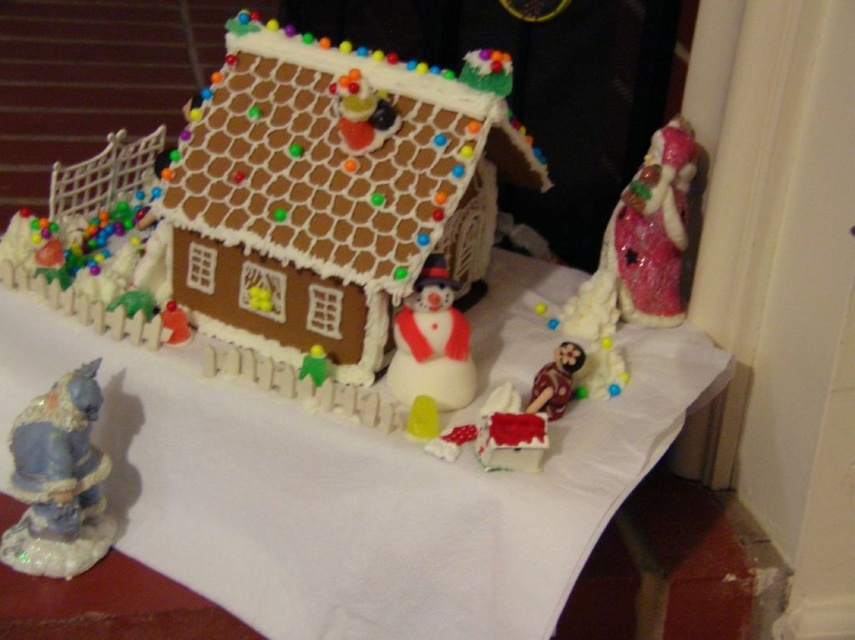
Question: Observing the image, what is the correct spatial positioning of white paper at center in reference to white matte snowman at center?

Choices:
 (A) below
 (B) above

Answer: (A)

Question: Which of the following is the farthest from the observer?

Choices:
 (A) white paper at center
 (B) matte blue cat at lower left

Answer: (B)

Question: Is matte blue cat at lower left to the left of white matte snowman at center from the viewer's perspective?

Choices:
 (A) no
 (B) yes

Answer: (B)

Question: Which object is the closest to the matte blue cat at lower left?

Choices:
 (A) white matte snowman at center
 (B) brown fondant house at center
 (C) white paper at center

Answer: (C)

Question: Which point is farther from the camera taking this photo?

Choices:
 (A) (42, 408)
 (B) (269, 486)

Answer: (B)

Question: Is brown fondant house at center below white paper at center?

Choices:
 (A) no
 (B) yes

Answer: (A)